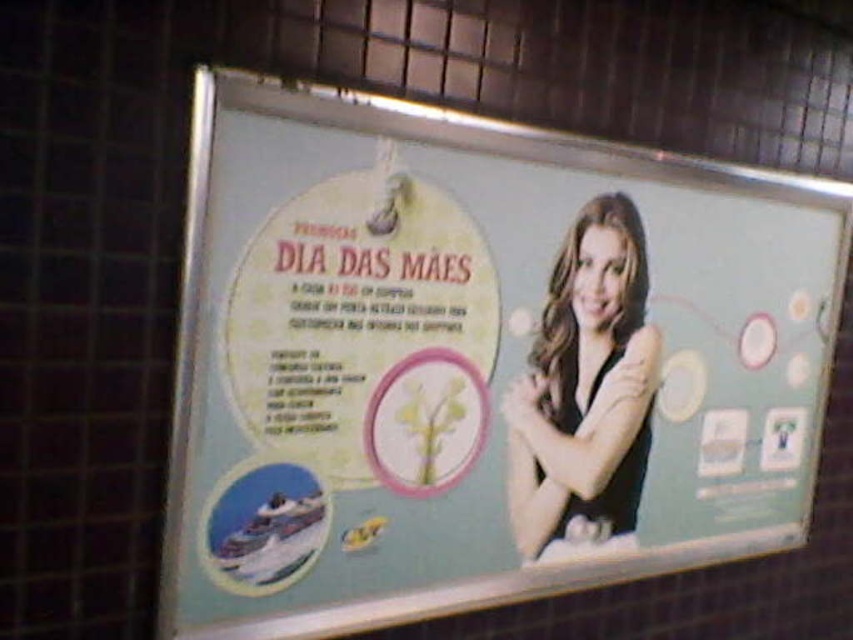
Where is the light blue paper at center located in terms of coordinates?

The light blue paper at center is located at coordinates point (477, 362).

You are a tailor who needs to hang a dress hanger that is 5 inches wide. You see the light blue paper at center and the black matte dress at right. Can you fit the hanger between them without overlapping either object?

The distance between the light blue paper at center and the black matte dress at right is 6.22 inches, which is wider than the hanger. Therefore, the hanger can be placed between them without overlapping.